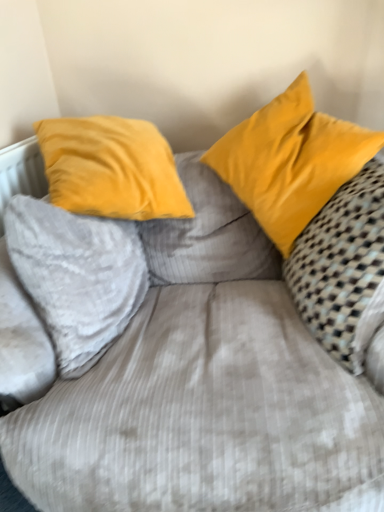
Question: Considering the positions of velvet yellow pillow at right, the third pillow in the left-to-right sequence, and yellow velvet pillow at upper right, marked as the 2th pillow in a left-to-right arrangement, in the image, is velvet yellow pillow at right, the third pillow in the left-to-right sequence, taller or shorter than yellow velvet pillow at upper right, marked as the 2th pillow in a left-to-right arrangement,?

Choices:
 (A) short
 (B) tall

Answer: (B)

Question: Considering the relative positions of velvet yellow pillow at right, the third pillow in the left-to-right sequence, and yellow velvet pillow at upper right, marked as the 2th pillow in a left-to-right arrangement, in the image provided, is velvet yellow pillow at right, the third pillow in the left-to-right sequence, to the left or to the right of yellow velvet pillow at upper right, marked as the 2th pillow in a left-to-right arrangement,?

Choices:
 (A) right
 (B) left

Answer: (A)

Question: Which of these objects is positioned farthest from the yellow velvet pillow at upper right, marked as the 2th pillow in a left-to-right arrangement?

Choices:
 (A) velvet yellow pillow at right, which is the 1th pillow from right to left
 (B) velvet yellow pillow at upper left, the 1th pillow when ordered from left to right

Answer: (B)

Question: Estimate the real-world distances between objects in this image. Which object is closer to the velvet yellow pillow at upper left, the 3th pillow in the right-to-left sequence?

Choices:
 (A) velvet yellow pillow at right, which is the 1th pillow from right to left
 (B) yellow velvet pillow at upper right, which is the second pillow in right-to-left order

Answer: (B)